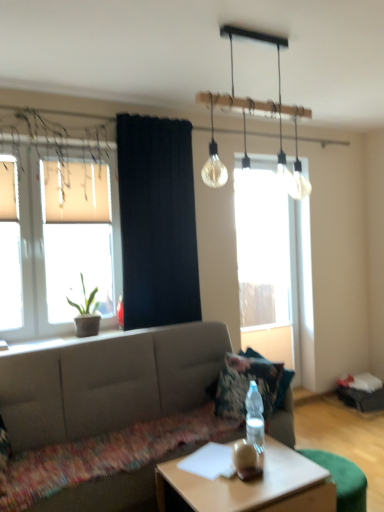
Question: Relative to translucent glass window at left, placed as the 2th window when sorted from right to left, is translucent glass light fixture at upper center in front or behind?

Choices:
 (A) behind
 (B) front

Answer: (B)

Question: Considering the positions of translucent glass light fixture at upper center and translucent glass window at left, the first window viewed from the left, in the image, is translucent glass light fixture at upper center bigger or smaller than translucent glass window at left, the first window viewed from the left,?

Choices:
 (A) small
 (B) big

Answer: (B)

Question: Which object is the closest to the transparent glass window at center, which is the first window from back to front?

Choices:
 (A) green matte plant at left
 (B) clear plastic bottle at center
 (C) matte gray couch at center
 (D) translucent glass window at left, the 1th window when ordered from front to back
 (E) wooden desk at center

Answer: (C)

Question: Which object is positioned closest to the translucent glass window at left, the 1th window when ordered from front to back?

Choices:
 (A) green matte plant at left
 (B) translucent glass light fixture at upper center
 (C) black fabric curtain at center
 (D) clear plastic bottle at center
 (E) wooden desk at center

Answer: (A)